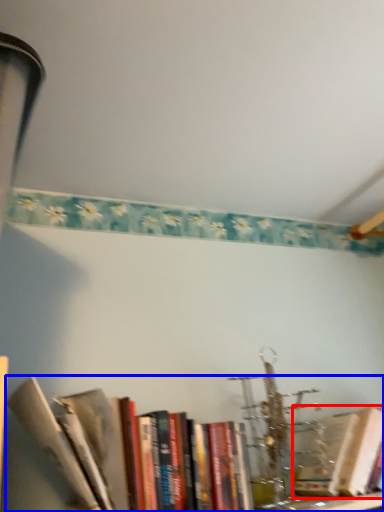
Question: Which object is further to the camera taking this photo, book (highlighted by a red box) or book (highlighted by a blue box)?

Choices:
 (A) book
 (B) book

Answer: (A)